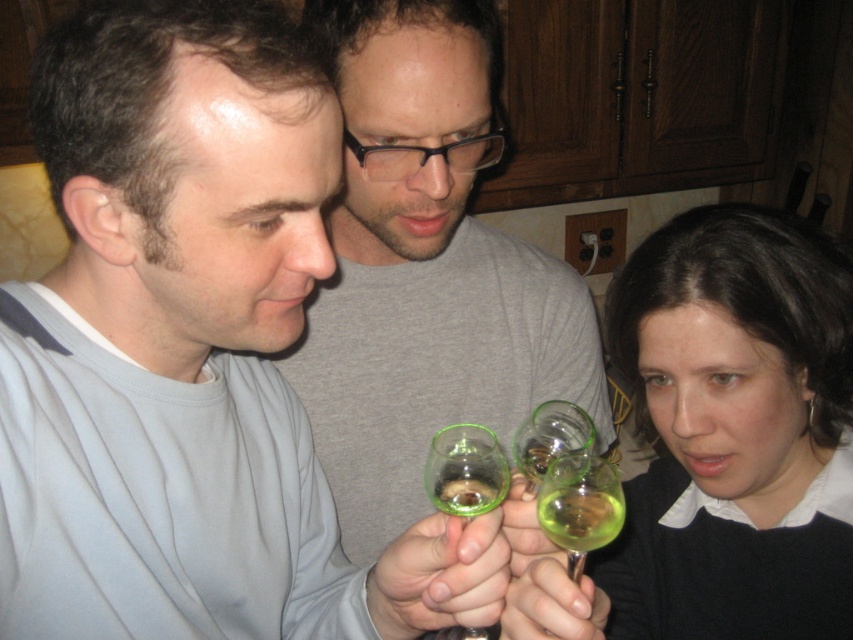
How much distance is there between green translucent glass at center and transparent glass at center?

green translucent glass at center and transparent glass at center are 6.02 centimeters apart.

Does green translucent glass at center have a larger size compared to transparent glass at center?

Yes.

The width and height of the screenshot is (853, 640). What are the coordinates of `green translucent glass at center` in the screenshot? It's located at pos(465,470).

Which is above, green glass wine glass at center or transparent glass at center?

transparent glass at center is above.

Find the location of a particular element. This screenshot has height=640, width=853. green glass wine glass at center is located at coordinates (x=735, y=429).

Is green glass wine glass at center closer to camera compared to green translucent glass at center?

No.

Which of these two, green glass wine glass at center or green translucent glass at center, stands taller?

green glass wine glass at center

Who is more distant from viewer, (x=815, y=456) or (x=485, y=506)?

The point (x=815, y=456) is behind.

Find the location of a particular element. The image size is (853, 640). green glass wine glass at center is located at coordinates (735, 429).